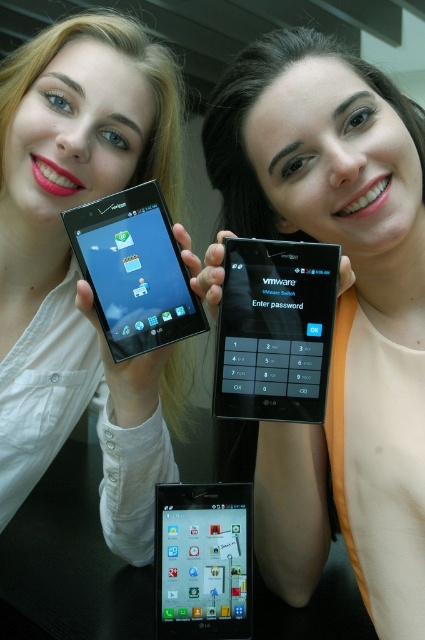
Question: Does black glossy tablet at upper left have a greater width compared to matte black tablet at center?

Choices:
 (A) yes
 (B) no

Answer: (A)

Question: Among these points, which one is nearest to the camera?

Choices:
 (A) (204, 624)
 (B) (300, 301)
 (C) (147, 164)
 (D) (257, 177)

Answer: (B)

Question: Which object is positioned closest to the matte black phone at center?

Choices:
 (A) matte black tablet at center
 (B) black glossy tablet at center
 (C) black glossy tablet at upper left

Answer: (B)

Question: Is matte black phone at upper left further to the viewer compared to black glossy tablet at center?

Choices:
 (A) no
 (B) yes

Answer: (B)

Question: Is black glossy tablet at center thinner than black glossy tablet at upper left?

Choices:
 (A) yes
 (B) no

Answer: (A)

Question: Estimate the real-world distances between objects in this image. Which object is closer to the matte black phone at center?

Choices:
 (A) matte black tablet at center
 (B) black glossy tablet at center

Answer: (B)